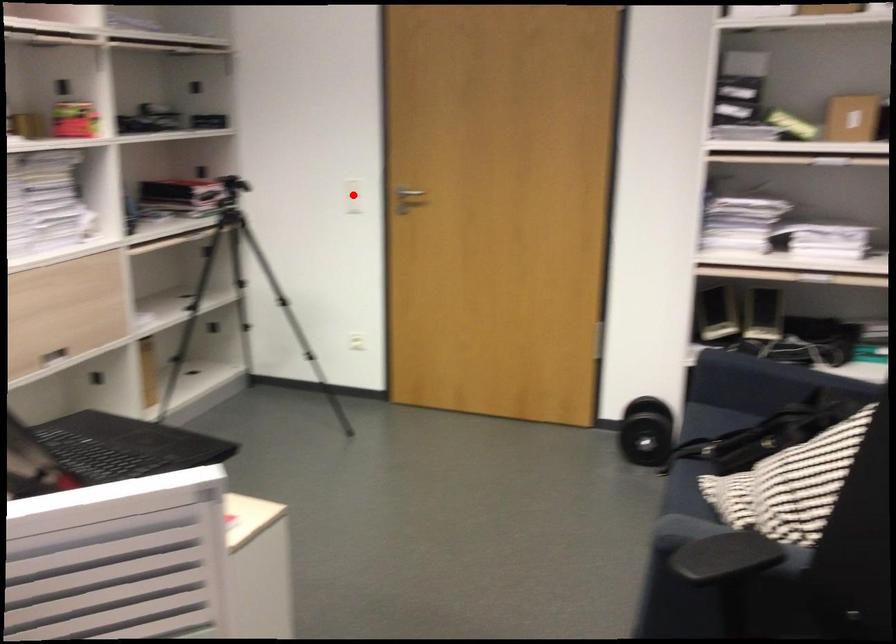
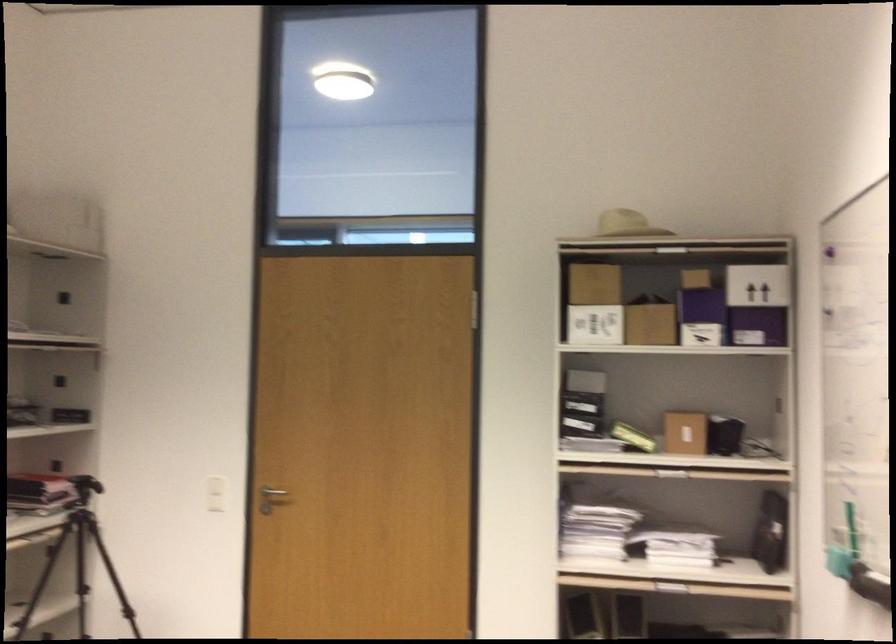
Where in the second image is the point corresponding to the highlighted location from the first image?

(216, 494)